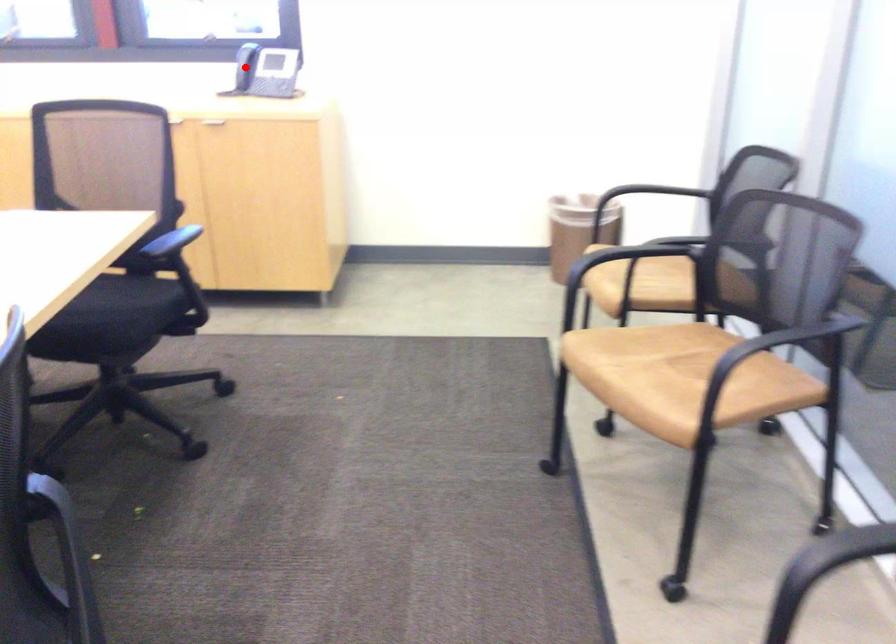
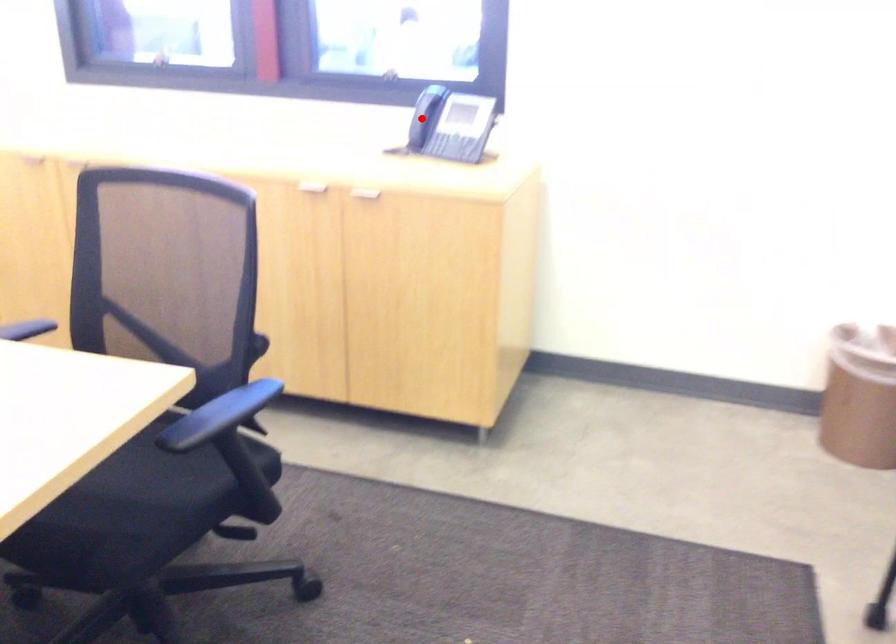
I am providing you with two images of the same scene from different viewpoints. A red point is marked on the first image and another point is marked on the second image. Is the red point in image1 aligned with the point shown in image2?

Yes